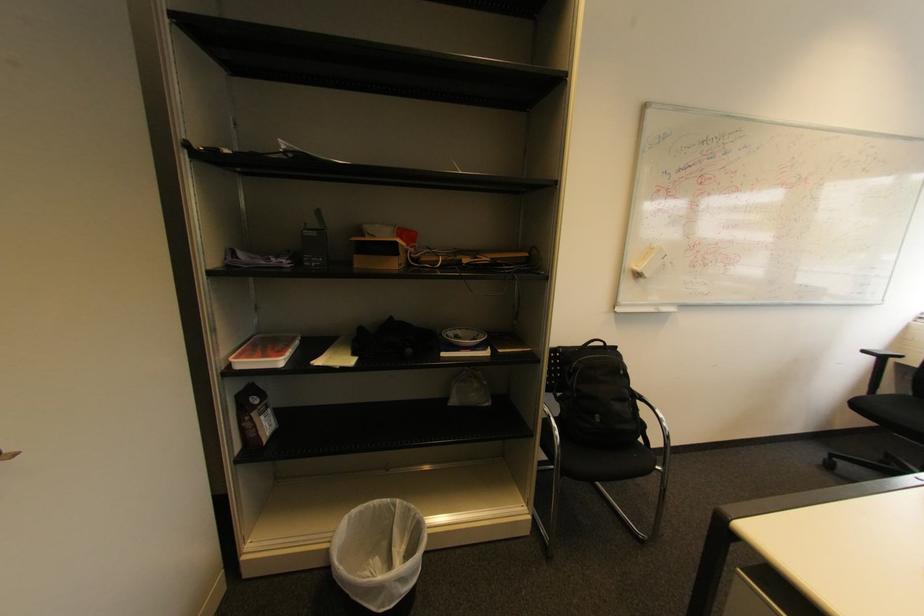
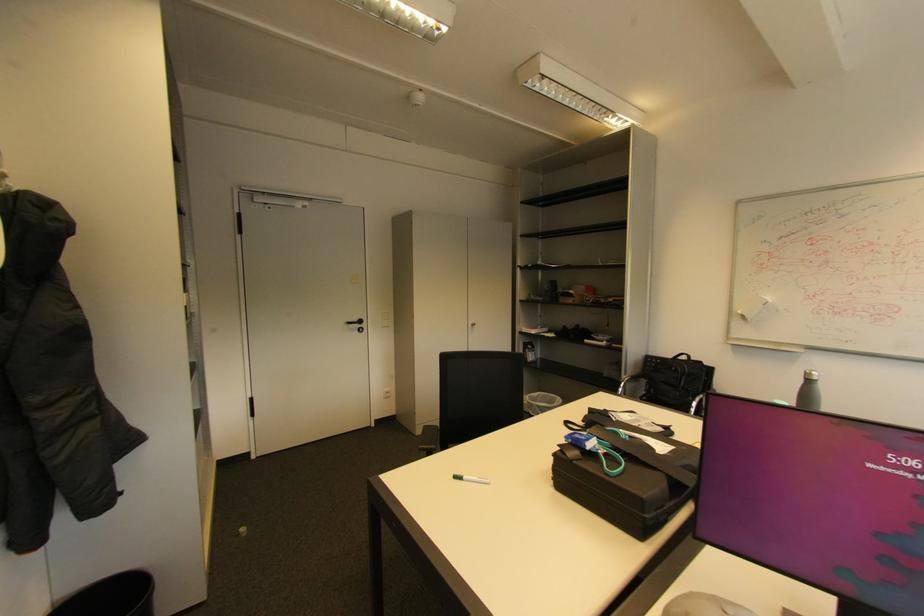
Find the pixel in the second image that matches point (380, 507) in the first image.

(556, 397)